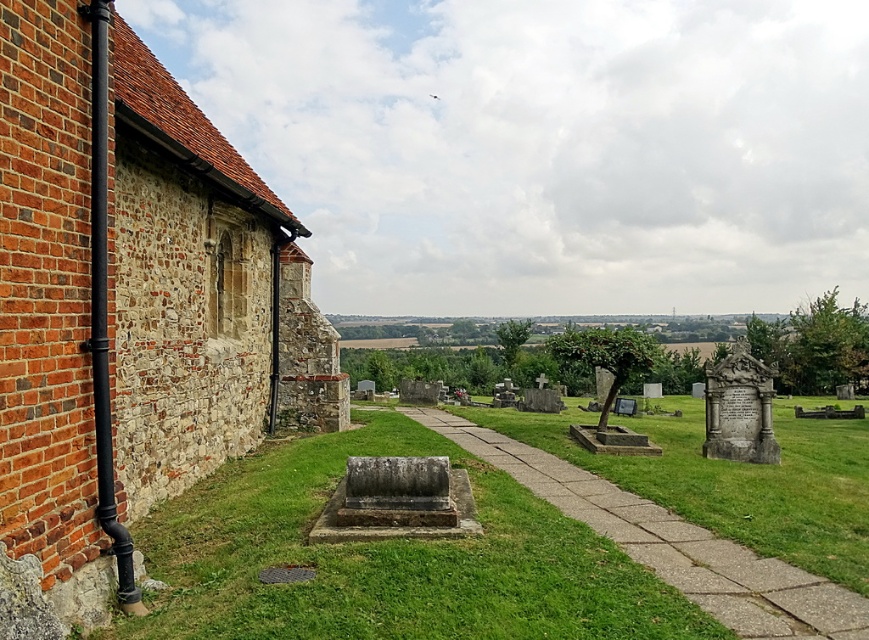
Does green grass at center have a greater width compared to concrete paving at center?

No.

Who is positioned more to the left, green grass at center or concrete paving at center?

From the viewer's perspective, green grass at center appears more on the left side.

The image size is (869, 640). I want to click on green grass at center, so pos(387,560).

Image resolution: width=869 pixels, height=640 pixels. I want to click on green grass at center, so click(387, 560).